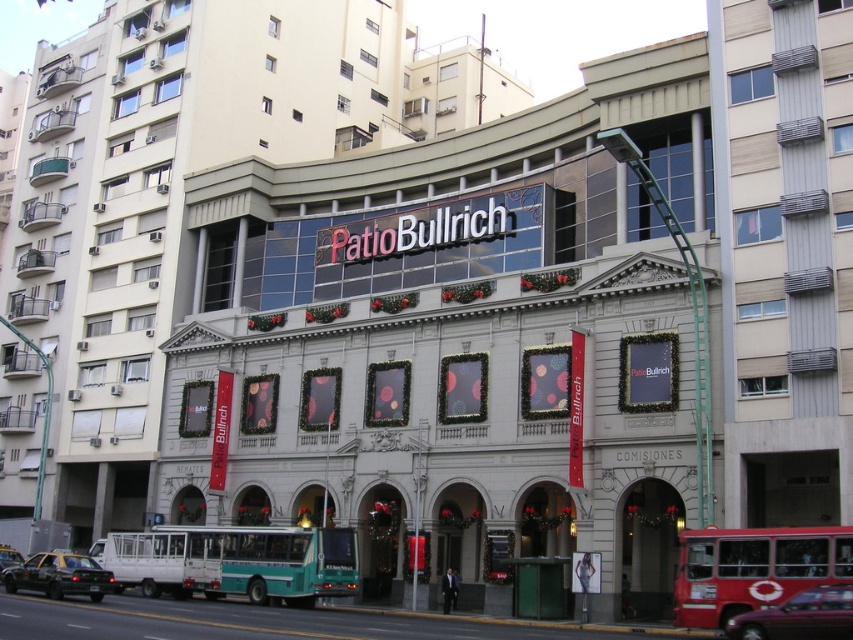
Is metallic red car at lower right smaller than black glossy car at lower left?

Correct, metallic red car at lower right occupies less space than black glossy car at lower left.

Between point (833, 589) and point (6, 566), which one is positioned in front?

Point (833, 589) is in front.

Is point (817, 637) closer to viewer compared to point (0, 556)?

Yes, it is in front of point (0, 556).

At what (x,y) coordinates should I click in order to perform the action: click on metallic red car at lower right. Please return your answer as a coordinate pair (x, y). The height and width of the screenshot is (640, 853). Looking at the image, I should click on (799, 616).

Who is positioned more to the left, metallic red car at lower right or black rubber car at lower left?

black rubber car at lower left

Who is shorter, metallic red car at lower right or black rubber car at lower left?

Standing shorter between the two is metallic red car at lower right.

What do you see at coordinates (799, 616) in the screenshot? Image resolution: width=853 pixels, height=640 pixels. I see `metallic red car at lower right` at bounding box center [799, 616].

Locate an element on the screen. This screenshot has height=640, width=853. metallic red car at lower right is located at coordinates (799, 616).

Is red rubber bus at lower right to the left of black rubber car at lower left from the viewer's perspective?

In fact, red rubber bus at lower right is to the right of black rubber car at lower left.

Can you confirm if red rubber bus at lower right is thinner than black rubber car at lower left?

Indeed, red rubber bus at lower right has a lesser width compared to black rubber car at lower left.

Where is `red rubber bus at lower right`? Image resolution: width=853 pixels, height=640 pixels. red rubber bus at lower right is located at coordinates (753, 568).

Image resolution: width=853 pixels, height=640 pixels. Find the location of `red rubber bus at lower right`. red rubber bus at lower right is located at coordinates (753, 568).